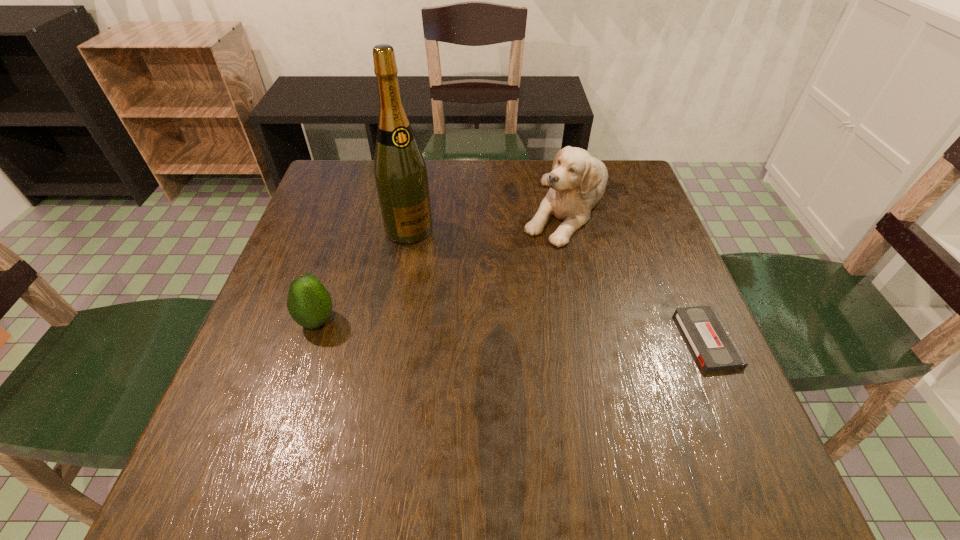
The height and width of the screenshot is (540, 960). I want to click on free space that is in between the third object from right to left and the leftmost object, so tap(363, 275).

At what (x,y) coordinates should I click in order to perform the action: click on unoccupied position between the second shortest object and the wine bottle. Please return your answer as a coordinate pair (x, y). This screenshot has width=960, height=540. Looking at the image, I should click on (363, 275).

Where is `free space between the wine bottle and the leftmost object`? free space between the wine bottle and the leftmost object is located at coordinates (363, 275).

At what (x,y) coordinates should I click in order to perform the action: click on vacant space in between the videotape and the third object from right to left. Please return your answer as a coordinate pair (x, y). This screenshot has height=540, width=960. Looking at the image, I should click on (558, 285).

You are a GUI agent. You are given a task and a screenshot of the screen. Output one action in this format:
    pyautogui.click(x=<x>, y=<y>)
    Task: Click on the vacant region between the second tallest object and the rightmost object
    This screenshot has width=960, height=540.
    Given the screenshot: What is the action you would take?
    pyautogui.click(x=636, y=272)

I want to click on free spot between the shortest object and the leftmost object, so click(x=512, y=330).

The height and width of the screenshot is (540, 960). In order to click on free space between the third object from left to right and the third tallest object in this screenshot , I will do `click(442, 262)`.

Identify which object is located as the third nearest to the shortest object. Please provide its 2D coordinates. Your answer should be formatted as a tuple, i.e. [(x, y)], where the tuple contains the x and y coordinates of a point satisfying the conditions above.

[(309, 303)]

Locate an element on the screen. This screenshot has width=960, height=540. object that is the third closest to the wine bottle is located at coordinates (714, 347).

At what (x,y) coordinates should I click in order to perform the action: click on vacant space that satisfies the following two spatial constraints: 1. on the back side of the puppy; 2. on the left side of the wine bottle. Please return your answer as a coordinate pair (x, y). The height and width of the screenshot is (540, 960). Looking at the image, I should click on (414, 204).